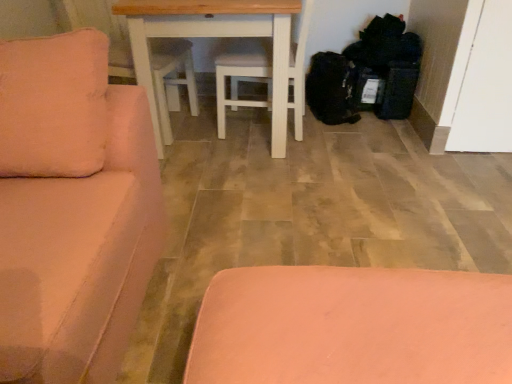
Question: Does velvet pink couch at left have a smaller size compared to pink matte ottoman at lower center?

Choices:
 (A) no
 (B) yes

Answer: (A)

Question: From the image's perspective, does velvet pink couch at left appear lower than pink matte ottoman at lower center?

Choices:
 (A) yes
 (B) no

Answer: (B)

Question: Is velvet pink couch at left wider than pink matte ottoman at lower center?

Choices:
 (A) yes
 (B) no

Answer: (B)

Question: Is velvet pink couch at left thinner than pink matte ottoman at lower center?

Choices:
 (A) no
 (B) yes

Answer: (B)

Question: Is velvet pink couch at left far away from pink matte ottoman at lower center?

Choices:
 (A) no
 (B) yes

Answer: (A)

Question: From the image's perspective, relative to black fabric bags at lower right, is pink matte ottoman at lower center above or below?

Choices:
 (A) below
 (B) above

Answer: (A)

Question: In the image, is pink matte ottoman at lower center on the left side or the right side of black fabric bags at lower right?

Choices:
 (A) left
 (B) right

Answer: (A)

Question: From a real-world perspective, is pink matte ottoman at lower center physically located above or below black fabric bags at lower right?

Choices:
 (A) above
 (B) below

Answer: (B)

Question: Looking at the image, does pink matte ottoman at lower center seem bigger or smaller compared to black fabric bags at lower right?

Choices:
 (A) small
 (B) big

Answer: (A)

Question: Do you think white painted wood table at center is within pink matte ottoman at lower center, or outside of it?

Choices:
 (A) inside
 (B) outside

Answer: (B)

Question: Considering the positions of point (237, 16) and point (328, 316), is point (237, 16) closer or farther from the camera than point (328, 316)?

Choices:
 (A) closer
 (B) farther

Answer: (B)

Question: Looking at their shapes, would you say white painted wood table at center is wider or thinner than pink matte ottoman at lower center?

Choices:
 (A) wide
 (B) thin

Answer: (B)

Question: Relative to pink matte ottoman at lower center, is white painted wood table at center in front or behind?

Choices:
 (A) front
 (B) behind

Answer: (B)

Question: Do you think velvet pink couch at left is within pink matte ottoman at lower center, or outside of it?

Choices:
 (A) inside
 (B) outside

Answer: (B)

Question: In terms of width, does velvet pink couch at left look wider or thinner when compared to pink matte ottoman at lower center?

Choices:
 (A) thin
 (B) wide

Answer: (A)